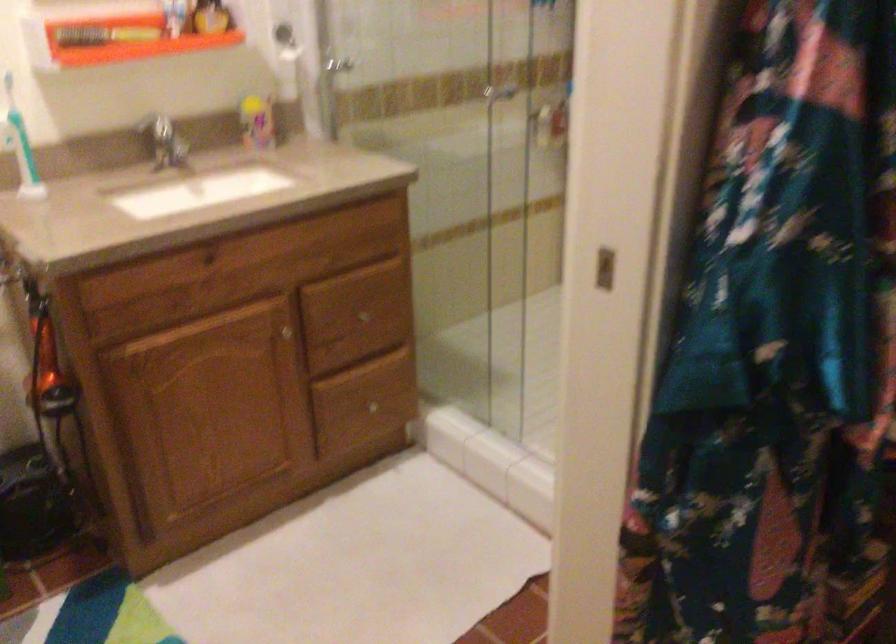
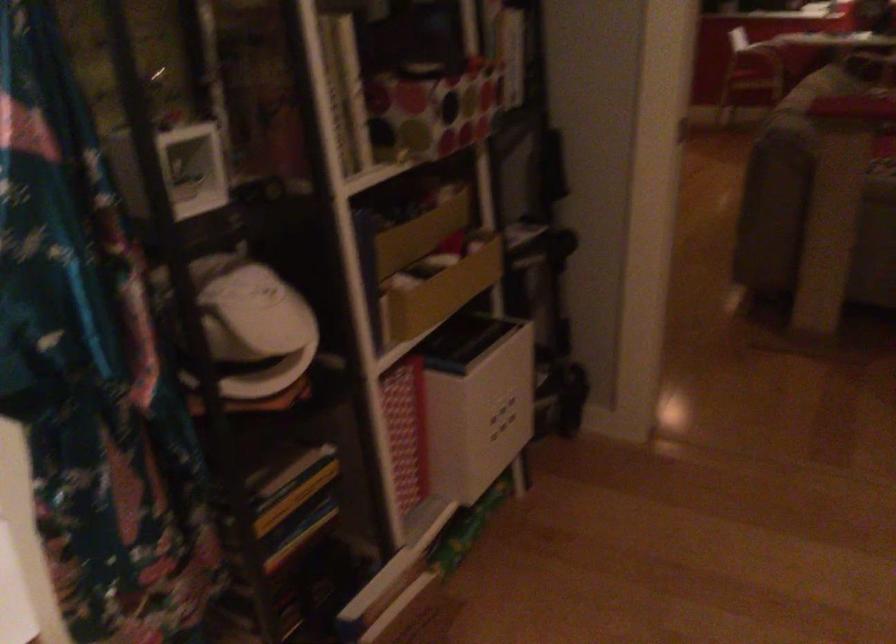
What movement of the cameraman would produce the second image?

The movement direction of the cameraman is right, backward.